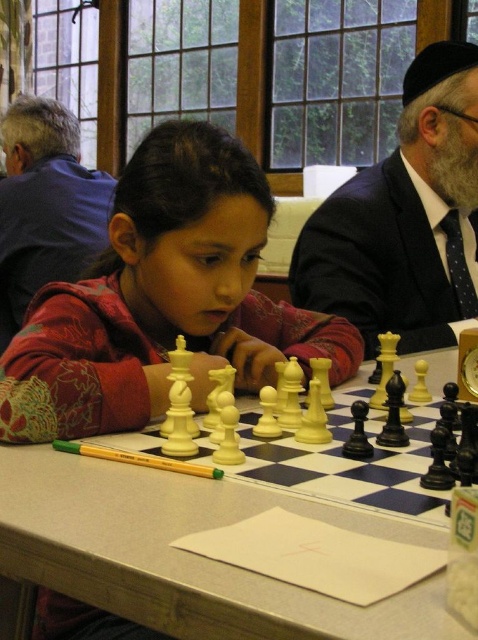
Can you confirm if white glossy chessboard at center is thinner than matte blue shirt at upper left?

In fact, white glossy chessboard at center might be wider than matte blue shirt at upper left.

Between white glossy chessboard at center and matte blue shirt at upper left, which one has more height?

matte blue shirt at upper left

The height and width of the screenshot is (640, 478). What do you see at coordinates (189, 554) in the screenshot?
I see `white glossy chessboard at center` at bounding box center [189, 554].

Locate an element on the screen. Image resolution: width=478 pixels, height=640 pixels. white glossy chessboard at center is located at coordinates (189, 554).

Is dark suit at center positioned behind matte blue shirt at upper left?

No, it is in front of matte blue shirt at upper left.

Which is above, dark suit at center or matte blue shirt at upper left?

matte blue shirt at upper left is above.

At what (x,y) coordinates should I click in order to perform the action: click on dark suit at center. Please return your answer as a coordinate pair (x, y). The width and height of the screenshot is (478, 640). Looking at the image, I should click on (404, 218).

Is point (193, 401) closer to viewer compared to point (47, 528)?

No.

Does matte plastic chess pieces at center have a greater height compared to white glossy chessboard at center?

Correct, matte plastic chess pieces at center is much taller as white glossy chessboard at center.

Is point (130, 328) positioned after point (237, 572)?

Yes, it is behind point (237, 572).

At what (x,y) coordinates should I click in order to perform the action: click on matte plastic chess pieces at center. Please return your answer as a coordinate pair (x, y). The height and width of the screenshot is (640, 478). Looking at the image, I should click on (162, 300).